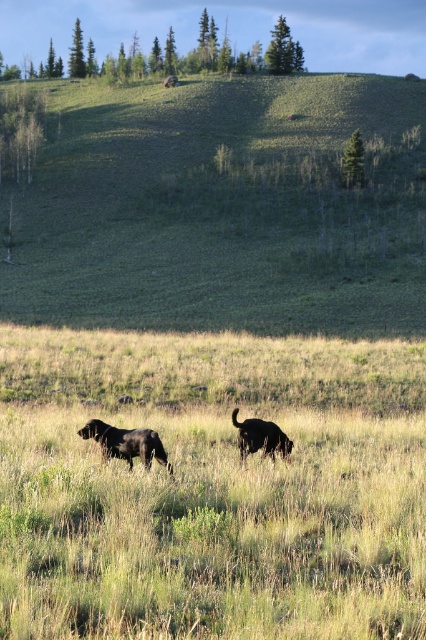
Can you confirm if shiny black dog at lower left is positioned to the right of black matte dog at center?

Incorrect, shiny black dog at lower left is not on the right side of black matte dog at center.

Which is below, shiny black dog at lower left or black matte dog at center?

black matte dog at center is below.

Is point (123, 448) in front of point (238, 422)?

Yes, point (123, 448) is in front of point (238, 422).

Where is `shiny black dog at lower left`? This screenshot has height=640, width=426. shiny black dog at lower left is located at coordinates (126, 442).

Is green grassy hillside at center below shiny black dog at lower left?

Incorrect, green grassy hillside at center is not positioned below shiny black dog at lower left.

Does green grassy hillside at center appear on the right side of shiny black dog at lower left?

Correct, you'll find green grassy hillside at center to the right of shiny black dog at lower left.

Describe the element at coordinates (224, 208) in the screenshot. I see `green grassy hillside at center` at that location.

In order to click on green grassy hillside at center in this screenshot , I will do `click(224, 208)`.

Between green grassy hillside at center and black matte dog at center, which one has less height?

Standing shorter between the two is black matte dog at center.

Does green grassy hillside at center appear on the right side of black matte dog at center?

Incorrect, green grassy hillside at center is not on the right side of black matte dog at center.

Is point (386, 328) closer to viewer compared to point (250, 449)?

No, it is behind (250, 449).

The width and height of the screenshot is (426, 640). I want to click on green grassy hillside at center, so click(x=224, y=208).